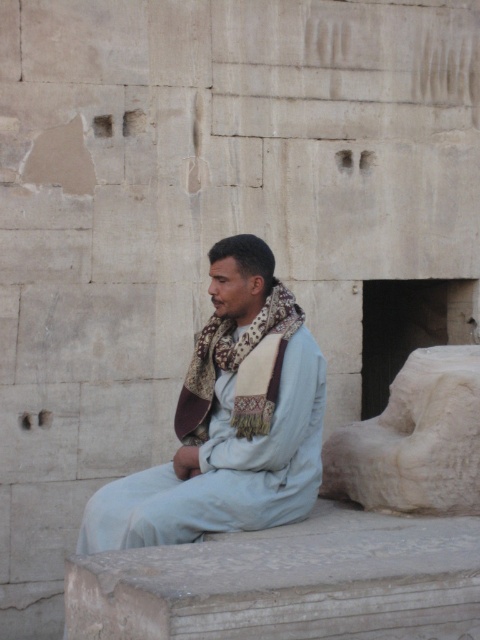
Question: Does light blue fabric at center have a larger size compared to white stone statue at right?

Choices:
 (A) no
 (B) yes

Answer: (B)

Question: Is light blue fabric at center smaller than white stone statue at right?

Choices:
 (A) no
 (B) yes

Answer: (A)

Question: Estimate the real-world distances between objects in this image. Which object is farther from the smooth gray stone at lower center?

Choices:
 (A) light blue fabric at center
 (B) white stone statue at right

Answer: (B)

Question: Which object is the closest to the smooth gray stone at lower center?

Choices:
 (A) white stone statue at right
 (B) light blue fabric at center

Answer: (B)

Question: Is smooth gray stone at lower center to the right of light blue fabric at center from the viewer's perspective?

Choices:
 (A) yes
 (B) no

Answer: (A)

Question: Estimate the real-world distances between objects in this image. Which object is farther from the white stone statue at right?

Choices:
 (A) smooth gray stone at lower center
 (B) light blue fabric at center

Answer: (B)